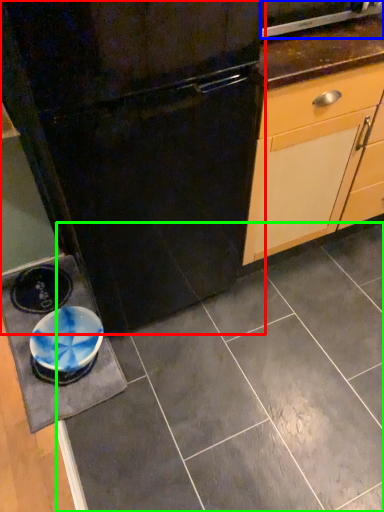
Question: Considering the real-world distances, which object is farthest from refrigerator (highlighted by a red box)? home appliance (highlighted by a blue box) or ceramic tile (highlighted by a green box)?

Choices:
 (A) home appliance
 (B) ceramic tile

Answer: (B)